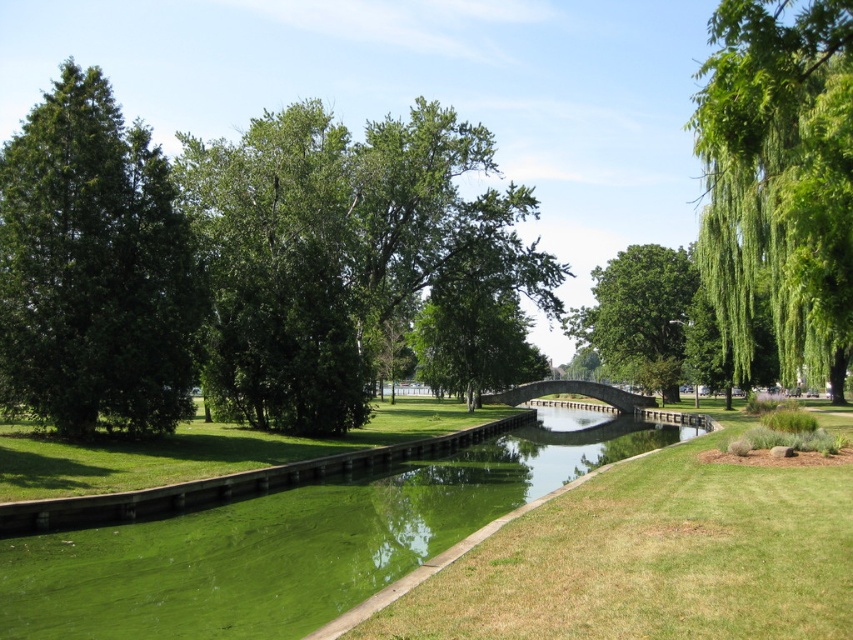
Can you confirm if green leafy tree at center is positioned above stone bridge at center?

Indeed, green leafy tree at center is positioned over stone bridge at center.

Is point (666, 349) in front of point (514, 401)?

That is False.

Is point (659, 246) positioned before point (525, 388)?

No, (659, 246) is further to viewer.

Where is `green leafy tree at center`? The width and height of the screenshot is (853, 640). green leafy tree at center is located at coordinates (637, 305).

Is the position of green algae-covered water at center less distant than that of green leafy tree at center?

Yes, it is in front of green leafy tree at center.

Does green algae-covered water at center appear on the left side of green leafy tree at center?

Indeed, green algae-covered water at center is positioned on the left side of green leafy tree at center.

Is point (253, 538) positioned before point (677, 289)?

Yes, it is.

You are a GUI agent. You are given a task and a screenshot of the screen. Output one action in this format:
    pyautogui.click(x=<x>, y=<y>)
    Task: Click on the green algae-covered water at center
    
    Given the screenshot: What is the action you would take?
    pyautogui.click(x=294, y=541)

Which is in front, point (78, 301) or point (573, 388)?

Point (78, 301) is in front.

Locate an element on the screen. green glossy tree at left is located at coordinates (93, 269).